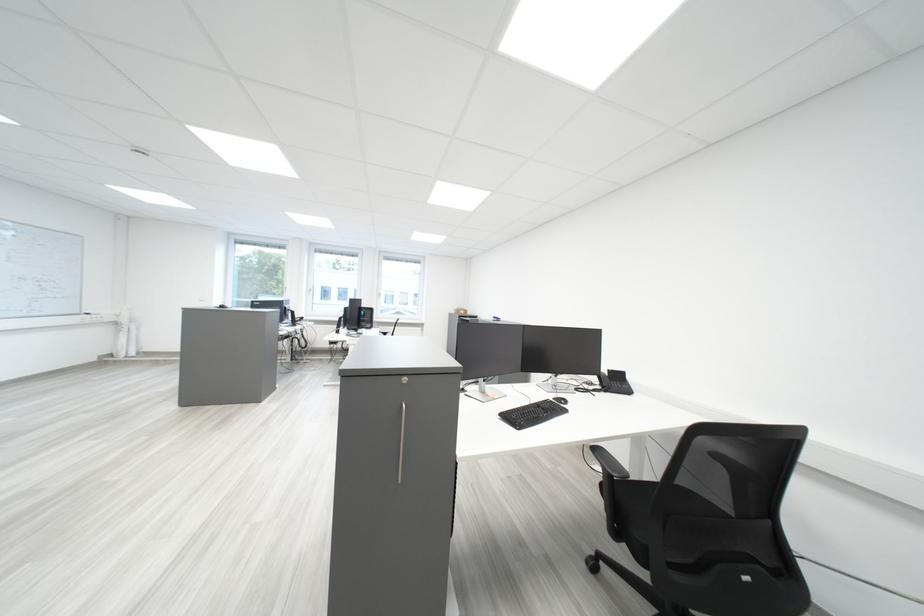
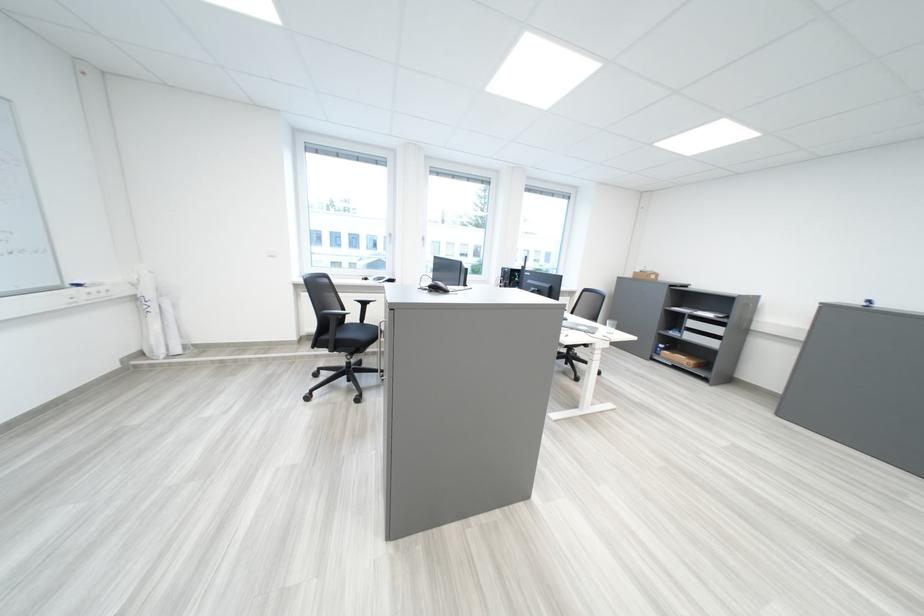
The point at (138,334) is marked in the first image. Where is the corresponding point in the second image?

(166, 318)